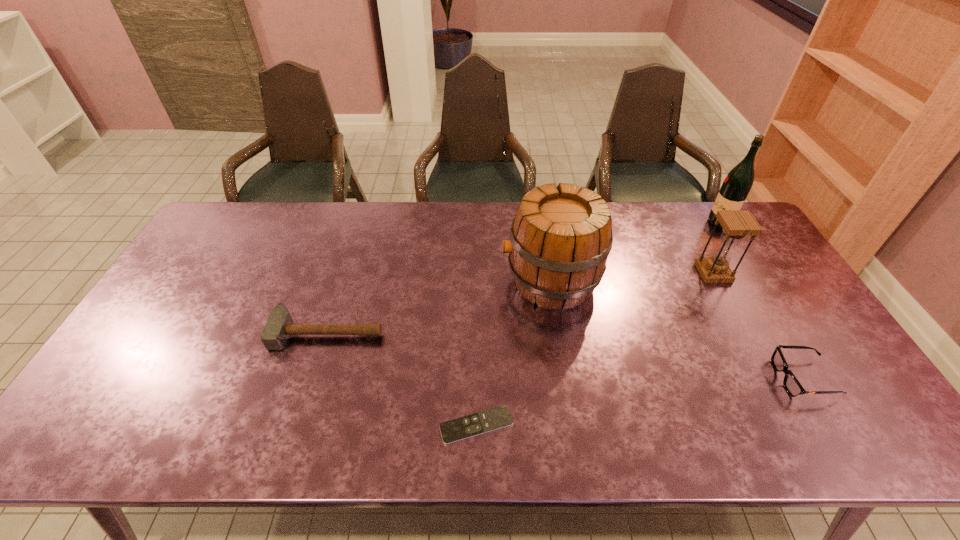
I want to click on blank space located 0.330m on the front-facing side of the liquor, so click(615, 222).

At what (x,y) coordinates should I click in order to perform the action: click on vacant space located 0.190m on the side of the cider where the spigot is located. Please return your answer as a coordinate pair (x, y). The image size is (960, 540). Looking at the image, I should click on (440, 281).

The image size is (960, 540). I want to click on free space located 0.370m on the side of the cider where the spigot is located, so click(381, 281).

This screenshot has width=960, height=540. Identify the location of free point located 0.090m on the side of the cider where the spigot is located. (472, 281).

Find the location of a particular element. Image resolution: width=960 pixels, height=540 pixels. free point located 0.230m on the left of the hourglass is located at coordinates (626, 273).

Where is `blank space located on the striking surface of the leftmost object`? This screenshot has height=540, width=960. blank space located on the striking surface of the leftmost object is located at coordinates (299, 426).

Locate an element on the screen. vacant space situated on the front-facing side of the second nearest object is located at coordinates (698, 379).

Where is `vacant point located on the front-facing side of the second nearest object`? This screenshot has height=540, width=960. vacant point located on the front-facing side of the second nearest object is located at coordinates (722, 379).

Find the location of `vacant space located on the front-facing side of the second nearest object`. vacant space located on the front-facing side of the second nearest object is located at coordinates pos(650,379).

Identify the location of blank area located 0.350m on the right of the remote control. (664, 425).